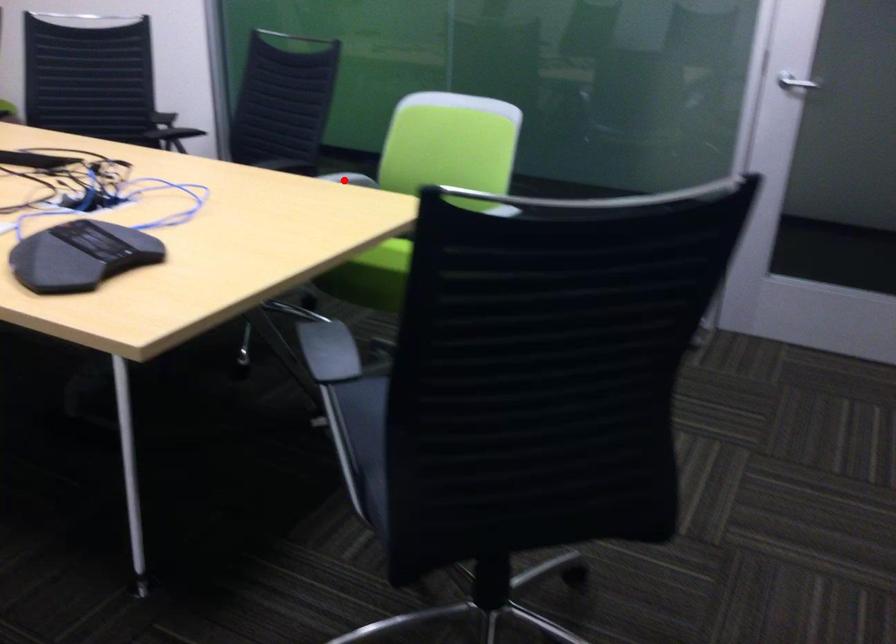
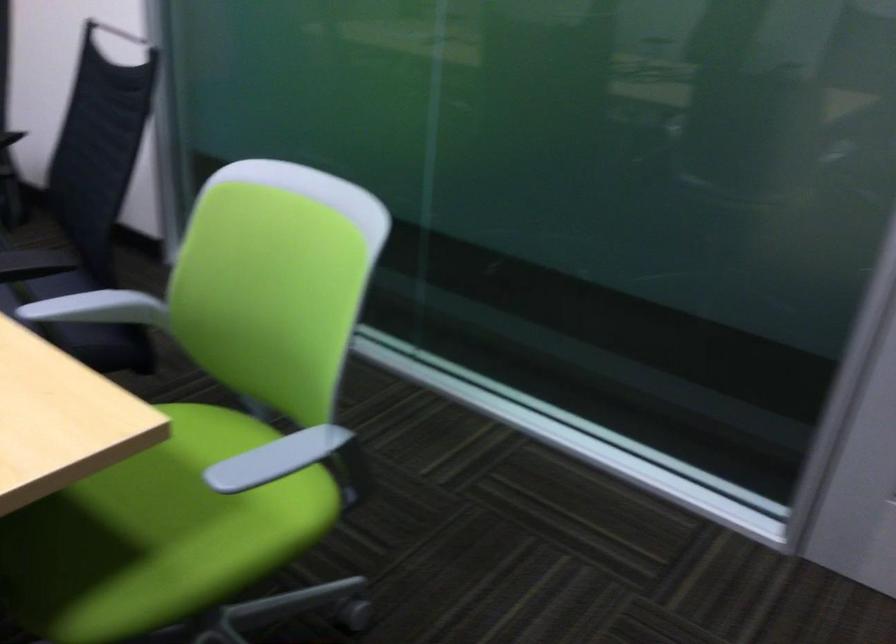
Question: I am providing you with two images of the same scene from different viewpoints. A red point is shown in image1. For the corresponding object point in image2, is it positioned nearer or farther from the camera?

Choices:
 (A) Nearer
 (B) Farther

Answer: (A)